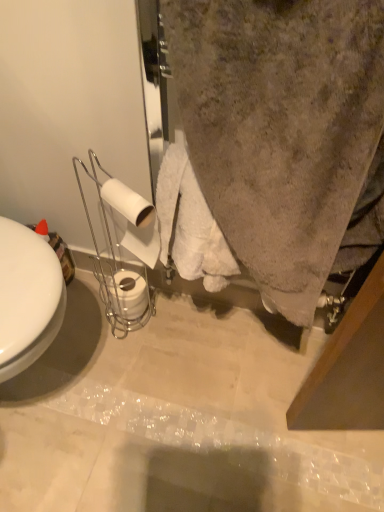
Question: Should I look upward or downward to see white matte toilet paper at lower center, the 2th toilet paper when ordered from top to bottom?

Choices:
 (A) up
 (B) down

Answer: (B)

Question: From a real-world perspective, is white matte toilet paper at lower center, the 1th toilet paper viewed from the back, located higher than white matte toilet paper at center left, acting as the 2th toilet paper starting from the bottom?

Choices:
 (A) no
 (B) yes

Answer: (A)

Question: From a real-world perspective, is white matte toilet paper at lower center, arranged as the 2th toilet paper when viewed from the front, beneath white matte toilet paper at center left, acting as the 2th toilet paper starting from the bottom?

Choices:
 (A) no
 (B) yes

Answer: (B)

Question: From the image's perspective, is white matte toilet paper at lower center, acting as the first toilet paper starting from the bottom, under white matte toilet paper at center left, the 1th toilet paper when ordered from top to bottom?

Choices:
 (A) no
 (B) yes

Answer: (B)

Question: Is white matte toilet paper at lower center, the 2th toilet paper when ordered from top to bottom, further to the viewer compared to white matte toilet paper at center left, the 2th toilet paper when ordered from back to front?

Choices:
 (A) yes
 (B) no

Answer: (A)

Question: Does white matte toilet paper at lower center, the 2th toilet paper when ordered from top to bottom, have a greater width compared to white matte toilet paper at center left, acting as the 2th toilet paper starting from the bottom?

Choices:
 (A) no
 (B) yes

Answer: (B)

Question: Are white matte toilet paper at lower center, the 2th toilet paper when ordered from top to bottom, and white matte toilet paper at center left, the 2th toilet paper when ordered from back to front, far apart?

Choices:
 (A) yes
 (B) no

Answer: (B)

Question: Is white matte toilet paper at center left, the 1th toilet paper when ordered from top to bottom, positioned before white matte toilet paper at lower center, acting as the first toilet paper starting from the bottom?

Choices:
 (A) yes
 (B) no

Answer: (A)

Question: Are white matte toilet paper at center left, the 1th toilet paper when ordered from top to bottom, and white matte toilet paper at lower center, acting as the first toilet paper starting from the bottom, far apart?

Choices:
 (A) no
 (B) yes

Answer: (A)

Question: Is white matte toilet paper at center left, the 1th toilet paper when ordered from top to bottom, directly adjacent to white matte toilet paper at lower center, the 1th toilet paper viewed from the back?

Choices:
 (A) yes
 (B) no

Answer: (B)

Question: Can you confirm if white matte toilet paper at center left, the 1th toilet paper when ordered from front to back, is smaller than white matte toilet paper at lower center, arranged as the 2th toilet paper when viewed from the front?

Choices:
 (A) yes
 (B) no

Answer: (B)

Question: Is white matte toilet paper at center left, acting as the 2th toilet paper starting from the bottom, looking in the opposite direction of white matte toilet paper at lower center, arranged as the 2th toilet paper when viewed from the front?

Choices:
 (A) no
 (B) yes

Answer: (A)

Question: From the image's perspective, is white matte toilet paper at center left, the 1th toilet paper when ordered from front to back, located above white matte toilet paper at lower center, arranged as the 2th toilet paper when viewed from the front?

Choices:
 (A) yes
 (B) no

Answer: (A)

Question: Is point (104, 190) closer or farther from the camera than point (119, 313)?

Choices:
 (A) closer
 (B) farther

Answer: (A)